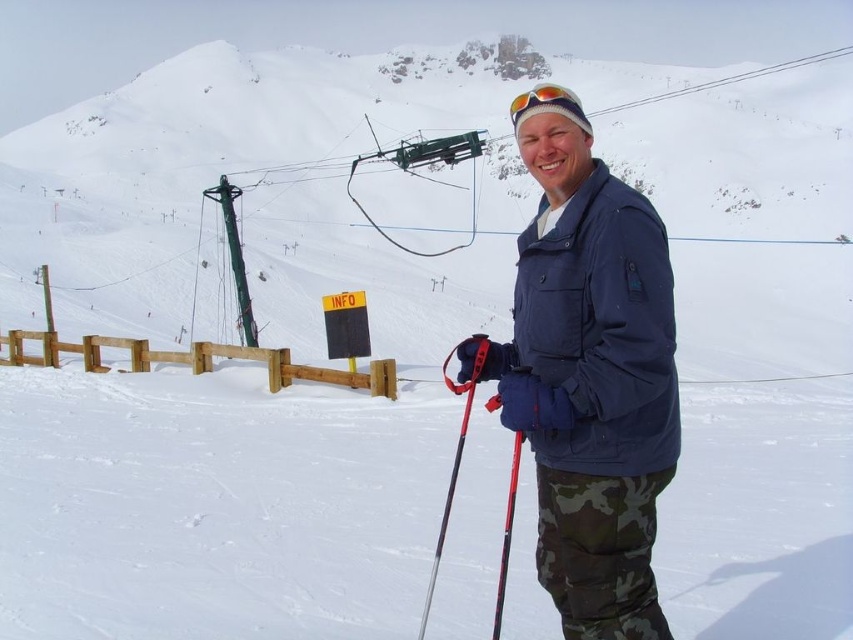
Who is lower down, metallic ski pole at center or red plastic ski pole at center?

Positioned lower is red plastic ski pole at center.

Between metallic ski pole at center and red plastic ski pole at center, which one has more height?

Standing taller between the two is metallic ski pole at center.

Is point (432, 566) closer to camera compared to point (517, 371)?

No, it is behind (517, 371).

At what (x,y) coordinates should I click in order to perform the action: click on metallic ski pole at center. Please return your answer as a coordinate pair (x, y). The height and width of the screenshot is (640, 853). Looking at the image, I should click on (454, 454).

Which is in front, point (494, 621) or point (529, 102)?

Point (494, 621)

Find the location of `red plastic ski pole at center`. red plastic ski pole at center is located at coordinates (508, 532).

In the scene shown: Can you confirm if blue fabric jacket at center is wider than multicolored plastic goggles at center?

In fact, blue fabric jacket at center might be narrower than multicolored plastic goggles at center.

Is point (595, 186) farther from viewer compared to point (509, 113)?

No, (595, 186) is in front of (509, 113).

Describe the element at coordinates (589, 378) in the screenshot. I see `blue fabric jacket at center` at that location.

At what (x,y) coordinates should I click in order to perform the action: click on blue fabric jacket at center. Please return your answer as a coordinate pair (x, y). The height and width of the screenshot is (640, 853). Looking at the image, I should click on (589, 378).